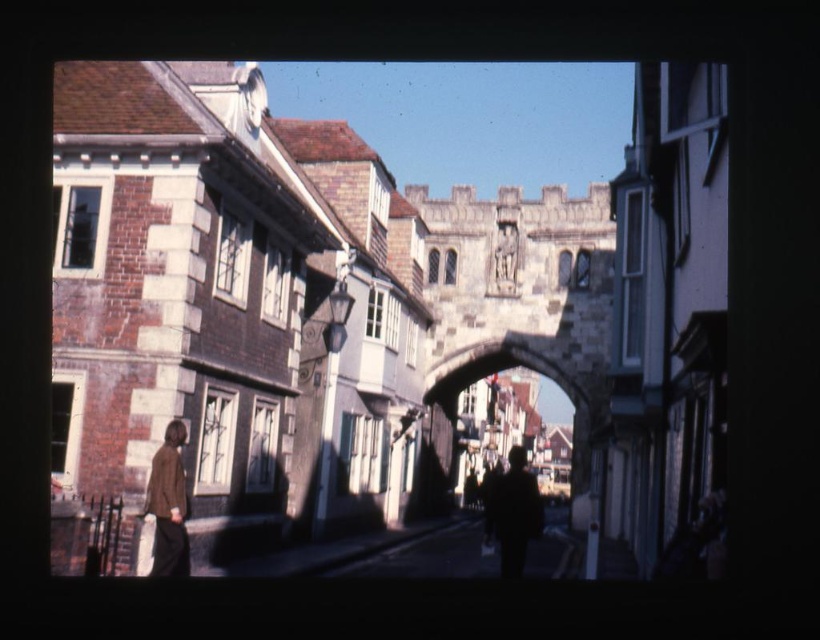
You are an artist sketching this scene. You notice the brown leather jacket at lower left and the dark silhouette figure at center. Which object is shorter in height?

The brown leather jacket at lower left is shorter in height compared to the dark silhouette figure at center.

You are standing in the historic urban setting shown in the image. You need to determine if the brick and stone archway at center can be seen from the position of the brown leather jacket at lower left. Can you see the archway from there?

The brick and stone archway at center is bigger than the brown leather jacket at lower left, but this does not necessarily indicate visibility. Since the scene is described as picturesque with buildings and an open street, it is likely that the archway is visible from the jacket position unless blocked by other structures. However, without specific details about obstructions, we can assume the archway is visible given the open layout.

You are standing in front of a historic building and want to take a photo of the brick and stone archway at center. If you are exactly 44.87 meters away from it, will you be able to capture the entire archway in your camera frame without moving closer?

Yes, because the distance between you and the brick and stone archway at center is exactly 44.87 meters, which is the minimum required to capture the entire archway in your camera frame without moving closer.